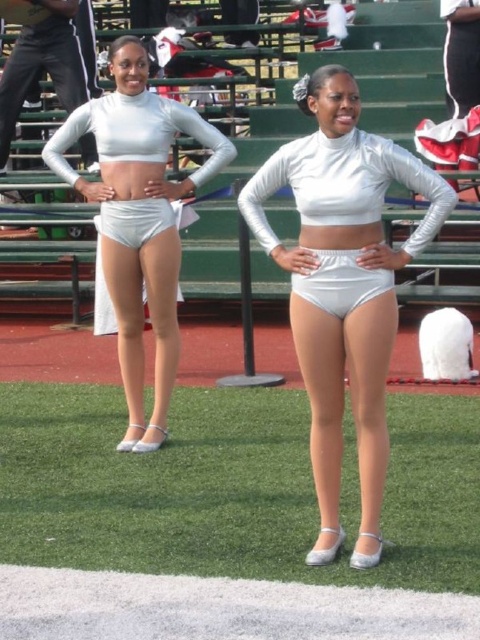
Question: Which point is farther to the camera?

Choices:
 (A) white matte underwear at center
 (B) silver metallic shorts at center
 (C) white matte shorts at center
 (D) silver shiny shorts at center

Answer: (C)

Question: Which object is the closest to the silver shiny shorts at center?

Choices:
 (A) white matte shorts at center
 (B) white matte underwear at center
 (C) silver metallic shorts at center

Answer: (B)

Question: Does silver shiny shorts at center lie in front of white matte shorts at center?

Choices:
 (A) no
 (B) yes

Answer: (B)

Question: Observing the image, what is the correct spatial positioning of white matte underwear at center in reference to white matte shorts at center?

Choices:
 (A) left
 (B) right

Answer: (A)

Question: Which object is farther from the camera taking this photo?

Choices:
 (A) white matte underwear at center
 (B) white matte shorts at center

Answer: (B)

Question: Is silver shiny shorts at center smaller than silver metallic shorts at center?

Choices:
 (A) no
 (B) yes

Answer: (B)